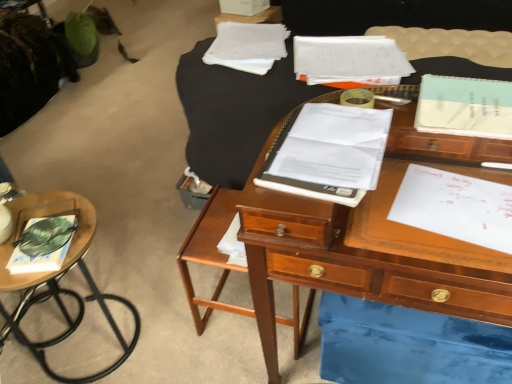
Question: Is white paper notebook at center, which is the second notebook in left-to-right order, located outside white paper at right?

Choices:
 (A) yes
 (B) no

Answer: (A)

Question: From the image's perspective, is white paper notebook at center, the 2th notebook positioned from the right, located above white paper at right?

Choices:
 (A) yes
 (B) no

Answer: (A)

Question: Can white paper at right be found inside white paper notebook at center, the 2th notebook positioned from the right?

Choices:
 (A) yes
 (B) no

Answer: (B)

Question: Does white paper notebook at center, the third notebook when ordered from back to front, appear on the left side of white paper at right?

Choices:
 (A) no
 (B) yes

Answer: (B)

Question: Is white paper notebook at center, the 2th notebook positioned from the right, bigger than white paper at right?

Choices:
 (A) no
 (B) yes

Answer: (B)

Question: In terms of width, does wooden side table at lower left, positioned as the first table in left-to-right order, look wider or thinner when compared to light blue spiral notebook at upper right, positioned as the second notebook in top-to-bottom order?

Choices:
 (A) wide
 (B) thin

Answer: (A)

Question: Is wooden side table at lower left, the second table viewed from the right, in front of or behind light blue spiral notebook at upper right, the first notebook when ordered from right to left, in the image?

Choices:
 (A) behind
 (B) front

Answer: (A)

Question: Choose the correct answer: Is wooden side table at lower left, the second table viewed from the right, inside light blue spiral notebook at upper right, the 2th notebook in the back-to-front sequence, or outside it?

Choices:
 (A) outside
 (B) inside

Answer: (A)

Question: Is point tap(72, 211) positioned closer to the camera than point tap(471, 82)?

Choices:
 (A) farther
 (B) closer

Answer: (A)

Question: From the image's perspective, is hardcover book at left above or below white paper notebook at center, which is the second notebook in left-to-right order?

Choices:
 (A) above
 (B) below

Answer: (B)

Question: Is hardcover book at left inside the boundaries of white paper notebook at center, the 2th notebook positioned from the right, or outside?

Choices:
 (A) outside
 (B) inside

Answer: (A)

Question: In the image, is hardcover book at left positioned in front of or behind white paper notebook at center, positioned as the first notebook in front-to-back order?

Choices:
 (A) front
 (B) behind

Answer: (B)

Question: Is hardcover book at left wider or thinner than white paper notebook at center, which ranks as the third notebook in top-to-bottom order?

Choices:
 (A) thin
 (B) wide

Answer: (A)

Question: In the image, is white paper notebook at center, positioned as the first notebook in front-to-back order, positioned in front of or behind white paper at right?

Choices:
 (A) front
 (B) behind

Answer: (A)

Question: Considering the positions of white paper notebook at center, the third notebook when ordered from back to front, and white paper at right in the image, is white paper notebook at center, the third notebook when ordered from back to front, wider or thinner than white paper at right?

Choices:
 (A) wide
 (B) thin

Answer: (A)